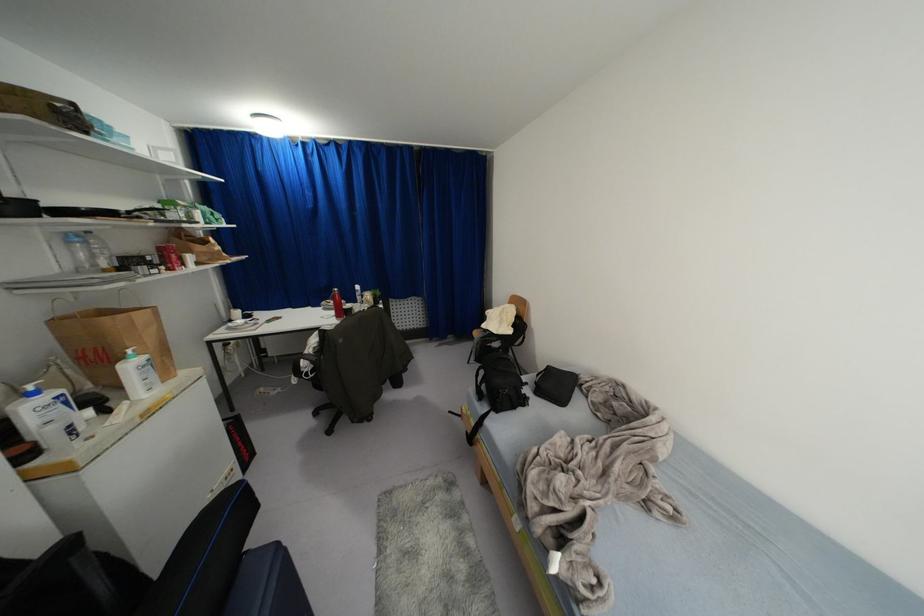
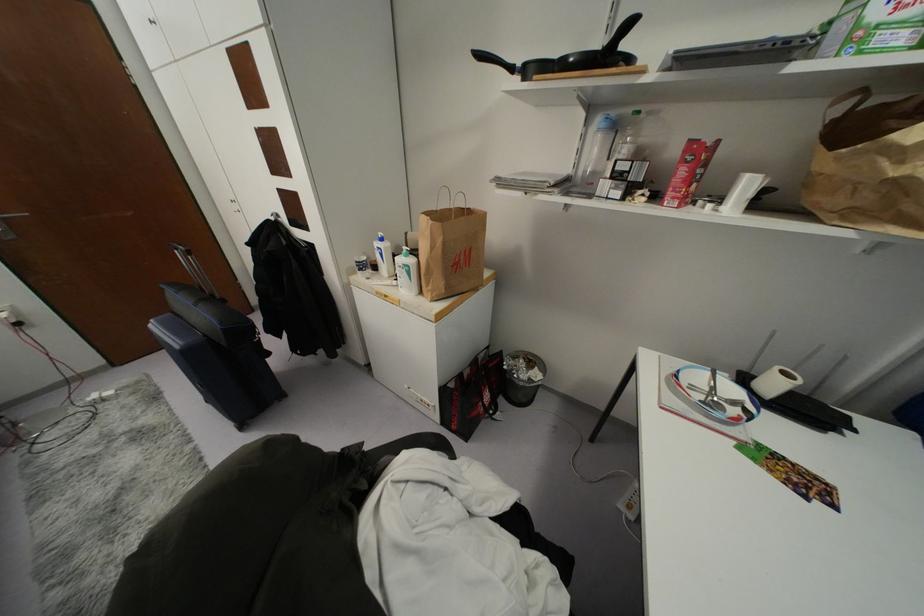
Find the pixel in the second image that matches (142,355) in the first image.

(410, 261)